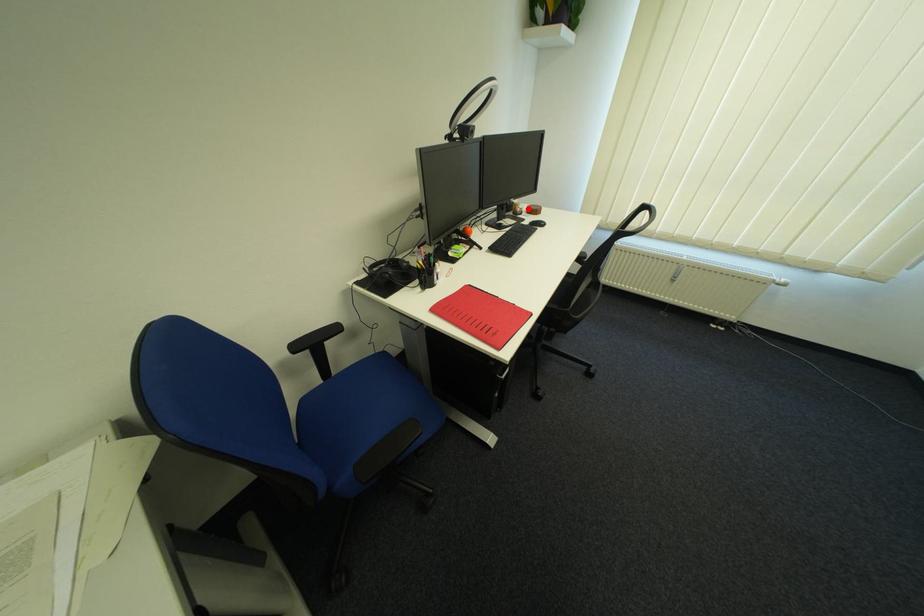
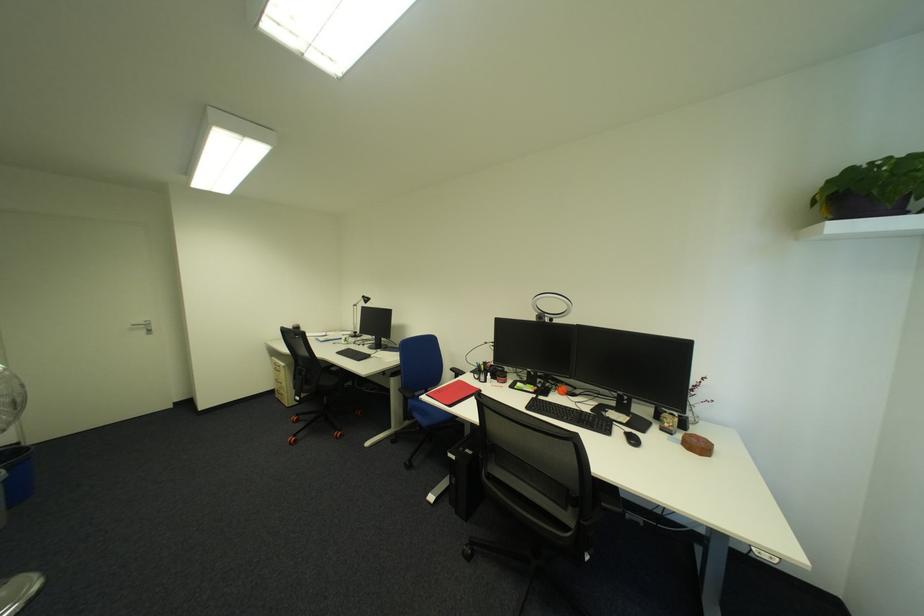
Question: I am providing you with two images of the same scene from different viewpoints. A red point is marked on the first image. At the location where the point appears in image 1, is it still visible in image 2?

Choices:
 (A) Yes
 (B) No

Answer: (A)